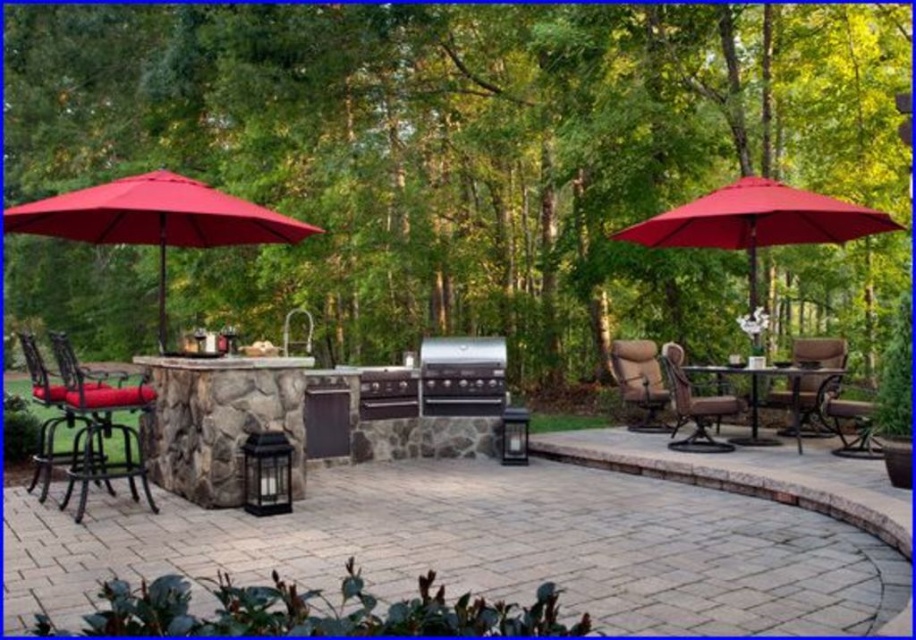
Which is in front, point (93, 420) or point (626, 392)?

Point (93, 420)

In the scene shown: Is metallic black bar stool at lower left to the right of brown fabric chair at center from the viewer's perspective?

No, metallic black bar stool at lower left is not to the right of brown fabric chair at center.

Who is more forward, (x=102, y=435) or (x=645, y=380)?

Point (x=102, y=435)

Find the location of a particular element. This screenshot has height=640, width=916. metallic black bar stool at lower left is located at coordinates point(100,426).

Describe the element at coordinates (100, 426) in the screenshot. I see `metallic black bar stool at lower left` at that location.

Consider the image. Does metallic black bar stool at lower left come behind black stainless steel grill at center?

No, it is not.

Does point (137, 499) come farther from viewer compared to point (467, 353)?

No, (137, 499) is closer to viewer.

You are a GUI agent. You are given a task and a screenshot of the screen. Output one action in this format:
    pyautogui.click(x=<x>, y=<y>)
    Task: Click on the metallic black bar stool at lower left
    
    Given the screenshot: What is the action you would take?
    pyautogui.click(x=100, y=426)

Can you confirm if red fabric umbrella at upper right is shorter than brown fabric chair at center?

No.

Between point (651, 216) and point (660, 388), which one is positioned behind?

The point (651, 216) is behind.

Does point (780, 189) come farther from viewer compared to point (628, 381)?

No, it is not.

The width and height of the screenshot is (916, 640). In order to click on red fabric umbrella at upper right in this screenshot , I will do `click(758, 221)`.